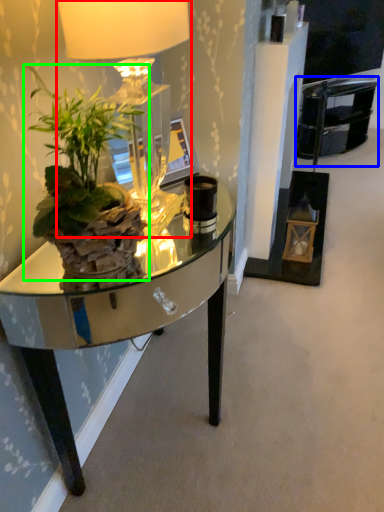
Question: Based on their relative distances, which object is nearer to lamp (highlighted by a red box)? Choose from armchair (highlighted by a blue box) and houseplant (highlighted by a green box).

Choices:
 (A) armchair
 (B) houseplant

Answer: (B)